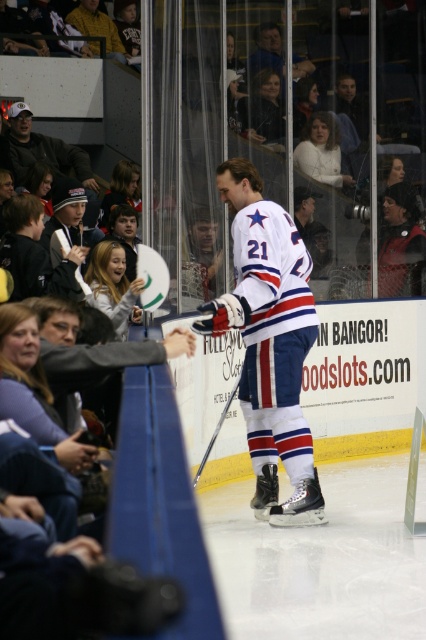
The image size is (426, 640). Find the location of `white jersey at center`. white jersey at center is located at coordinates (270, 342).

Who is more forward, (281, 417) or (20, 180)?

Point (281, 417) is more forward.

Measure the distance between white jersey at center and camera.

white jersey at center is 7.31 meters from camera.

You are a GUI agent. You are given a task and a screenshot of the screen. Output one action in this format:
    pyautogui.click(x=<x>, y=<y>)
    Task: Click on the white jersey at center
    The height and width of the screenshot is (640, 426).
    Given the screenshot: What is the action you would take?
    pyautogui.click(x=270, y=342)